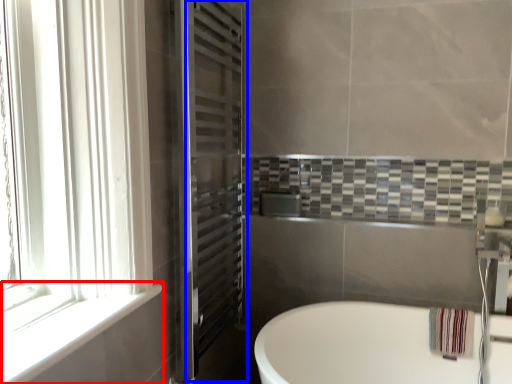
Question: Among these objects, which one is nearest to the camera, window sill (highlighted by a red box) or screen door (highlighted by a blue box)?

Choices:
 (A) window sill
 (B) screen door

Answer: (A)